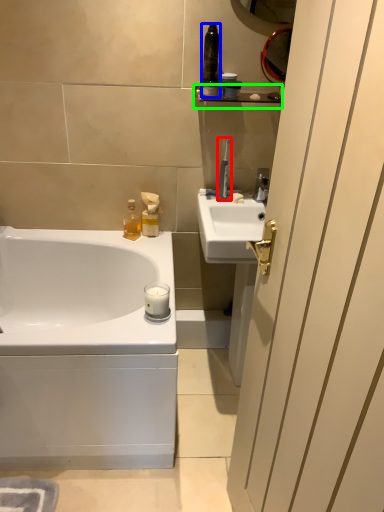
Question: Which object is the farthest from toothbrush (highlighted by a red box)? Choose among these: toiletry (highlighted by a blue box) or balustrade (highlighted by a green box).

Choices:
 (A) toiletry
 (B) balustrade

Answer: (A)